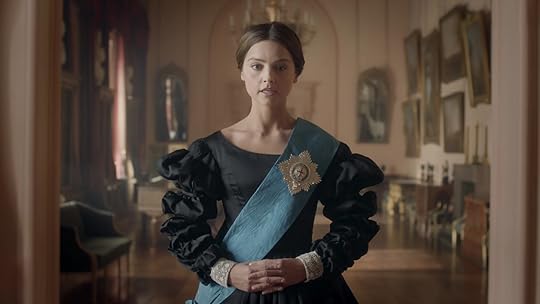
Where is `floor`? This screenshot has height=304, width=540. floor is located at coordinates (386, 278).